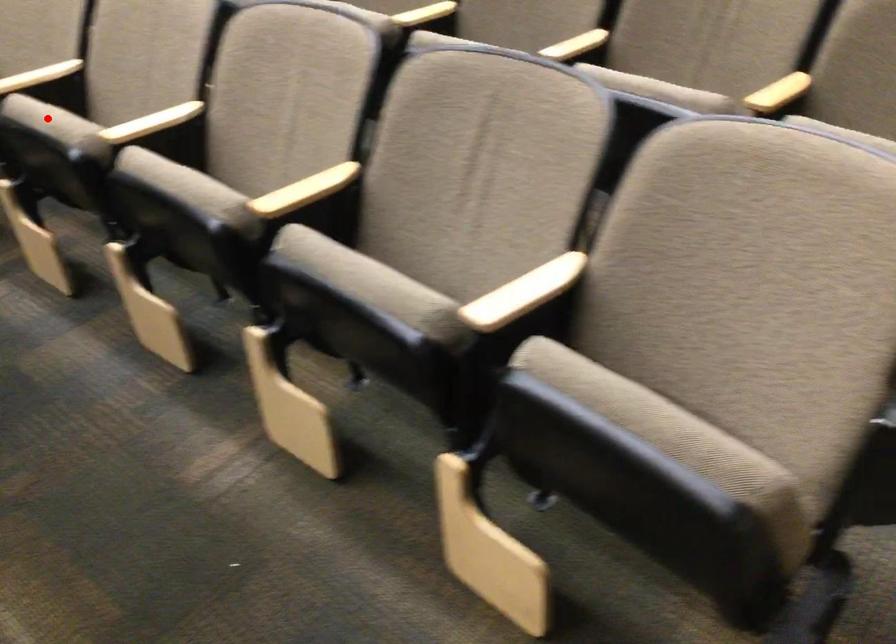
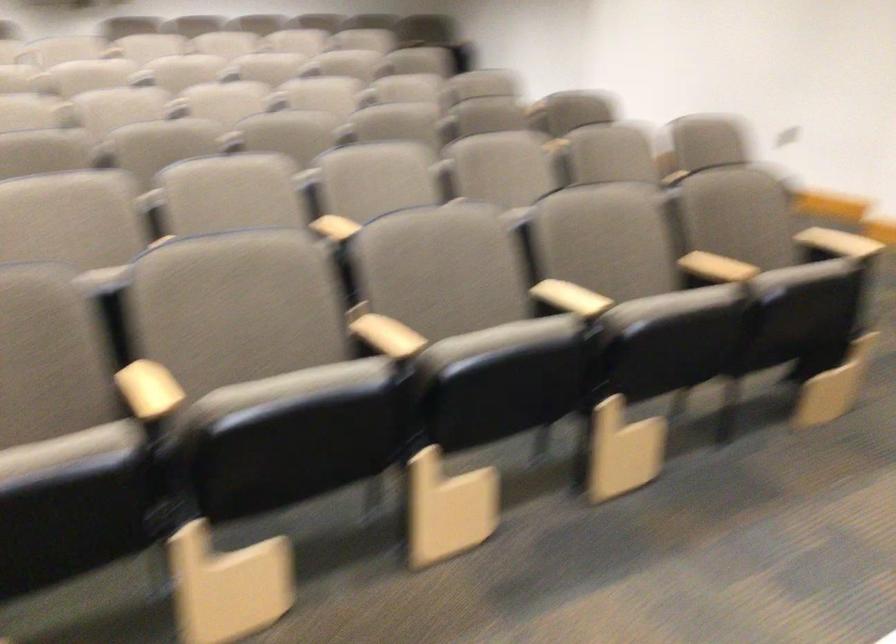
Question: I am providing you with two images of the same scene from different viewpoints. A red point is marked on the first image. At the location where the point appears in image 1, is it still visible in image 2?

Choices:
 (A) Yes
 (B) No

Answer: (B)